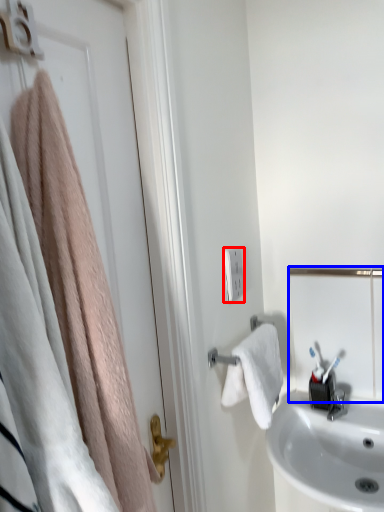
Question: Among these objects, which one is nearest to the camera, light switch (highlighted by a red box) or mirror (highlighted by a blue box)?

Choices:
 (A) light switch
 (B) mirror

Answer: (A)